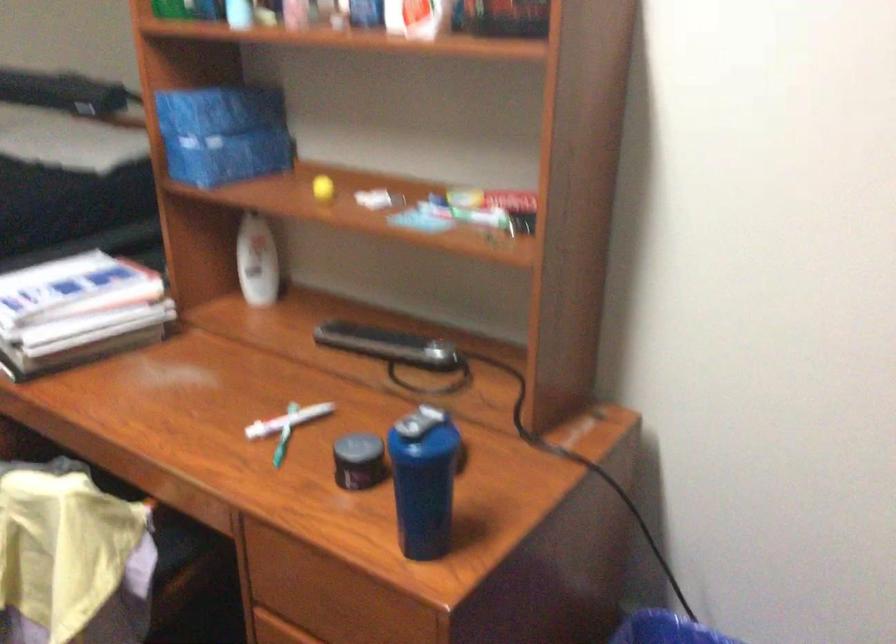
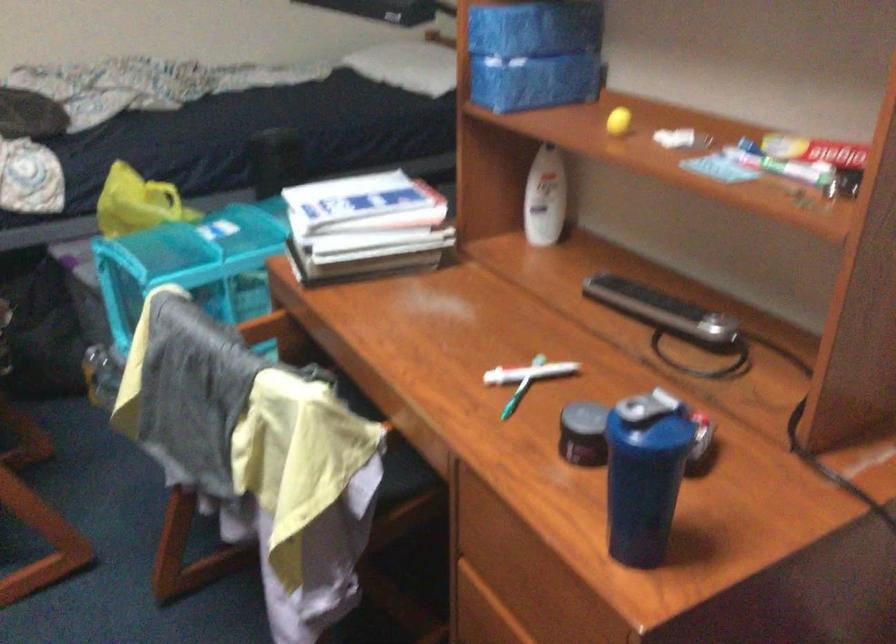
The point at (x=391, y=346) is marked in the first image. Where is the corresponding point in the second image?

(661, 308)